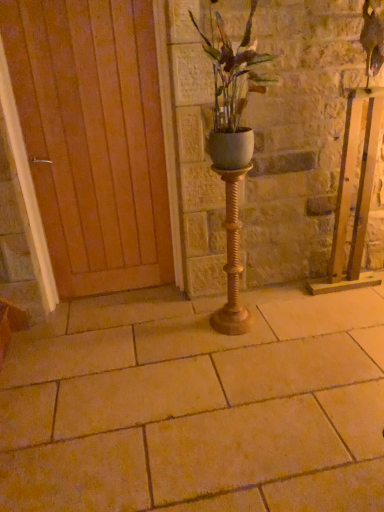
Question: Should I look upward or downward to see wooden at left?

Choices:
 (A) up
 (B) down

Answer: (A)

Question: Can you confirm if wooden at left is taller than beige stone pavement at center?

Choices:
 (A) no
 (B) yes

Answer: (B)

Question: Does wooden at left have a lesser height compared to beige stone pavement at center?

Choices:
 (A) yes
 (B) no

Answer: (B)

Question: Is wooden at left closer to camera compared to beige stone pavement at center?

Choices:
 (A) yes
 (B) no

Answer: (B)

Question: From the image's perspective, does wooden at left appear lower than beige stone pavement at center?

Choices:
 (A) no
 (B) yes

Answer: (A)

Question: Does wooden at left appear on the left side of beige stone pavement at center?

Choices:
 (A) yes
 (B) no

Answer: (A)

Question: Considering the relative sizes of wooden at left and beige stone pavement at center in the image provided, is wooden at left wider than beige stone pavement at center?

Choices:
 (A) no
 (B) yes

Answer: (A)

Question: Is wooden at left inside white matte pot at center?

Choices:
 (A) yes
 (B) no

Answer: (B)

Question: Considering the relative sizes of white matte pot at center and wooden at left in the image provided, is white matte pot at center shorter than wooden at left?

Choices:
 (A) no
 (B) yes

Answer: (B)

Question: Is white matte pot at center wider than wooden at left?

Choices:
 (A) yes
 (B) no

Answer: (A)

Question: Is wooden at left at the back of white matte pot at center?

Choices:
 (A) no
 (B) yes

Answer: (A)

Question: From a real-world perspective, is white matte pot at center positioned under wooden at left based on gravity?

Choices:
 (A) no
 (B) yes

Answer: (A)

Question: Is white matte pot at center at the right side of wooden at left?

Choices:
 (A) yes
 (B) no

Answer: (A)

Question: Is gold textured candle holder at center at the left side of white matte pot at center?

Choices:
 (A) yes
 (B) no

Answer: (A)